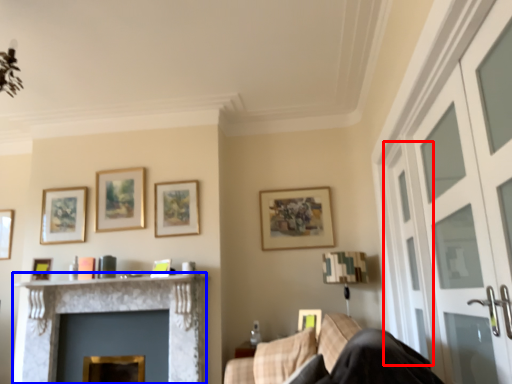
Question: Among these objects, which one is nearest to the camera, screen door (highlighted by a red box) or fireplace (highlighted by a blue box)?

Choices:
 (A) screen door
 (B) fireplace

Answer: (A)